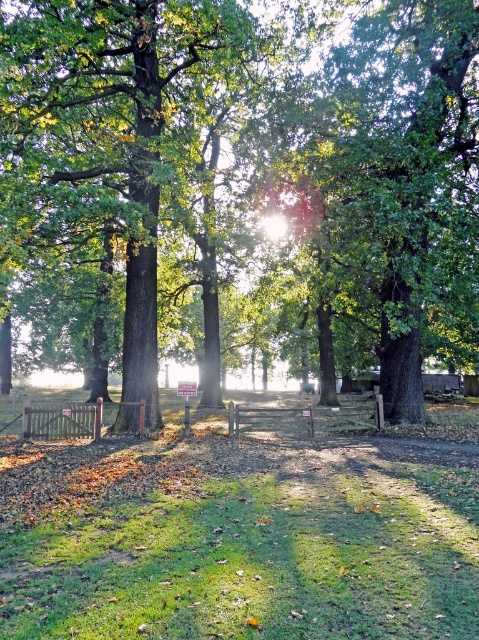
You are a gardener who needs to water both the green leafy tree at center and the green grass at center. Your watering can has a range of 6 meters. Without moving, can you water both areas from your current position?

The green leafy tree at center and green grass at center are 6.01 meters apart. Since your watering can only reaches 6 meters, you cannot water both areas without moving because the distance between them exceeds the can range.

You are a gardener planning to plant flowers in the green grass at center. Considering the green leafy tree at center, will the flowers receive enough sunlight?

A: The green leafy tree at center is positioned over green grass at center, so the flowers planted there may not receive enough sunlight due to the tree casting shade over the area.